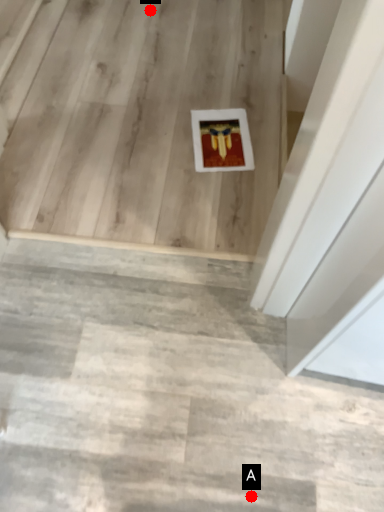
Question: Two points are circled on the image, labeled by A and B beside each circle. Which of the following is the farthest from the observer?

Choices:
 (A) A is further
 (B) B is further

Answer: (B)